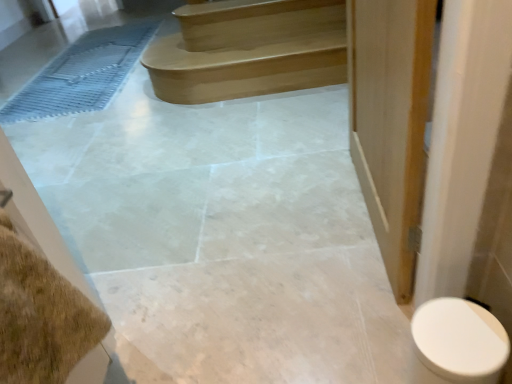
The height and width of the screenshot is (384, 512). Describe the element at coordinates (249, 50) in the screenshot. I see `satin wood stairs at upper center` at that location.

This screenshot has width=512, height=384. Identify the location of white glossy toilet at lower right. (457, 343).

You are a GUI agent. You are given a task and a screenshot of the screen. Output one action in this format:
    pyautogui.click(x=<x>, y=<y>)
    Task: Click on the blue rubber bath mat at left
    The image size is (512, 384).
    Given the screenshot: What is the action you would take?
    pyautogui.click(x=82, y=74)

Could you tell me if blue rubber bath mat at left is facing white glossy toilet at lower right?

No, blue rubber bath mat at left is not facing towards white glossy toilet at lower right.

Is blue rubber bath mat at left next to white glossy toilet at lower right?

No, blue rubber bath mat at left is not touching white glossy toilet at lower right.

Who is shorter, blue rubber bath mat at left or white glossy toilet at lower right?

blue rubber bath mat at left is shorter.

Is white glossy toilet at lower right with satin wood stairs at upper center?

No, white glossy toilet at lower right is not with satin wood stairs at upper center.

Does white glossy toilet at lower right have a lesser width compared to satin wood stairs at upper center?

Correct, the width of white glossy toilet at lower right is less than that of satin wood stairs at upper center.

Is the position of white glossy toilet at lower right less distant than that of satin wood stairs at upper center?

That is True.

Which of these two, white glossy toilet at lower right or blue rubber bath mat at left, stands taller?

white glossy toilet at lower right.

In the image, is white glossy toilet at lower right on the left side or the right side of blue rubber bath mat at left?

white glossy toilet at lower right is positioned on blue rubber bath mat at left's right side.

Between white glossy toilet at lower right and blue rubber bath mat at left, which one is positioned behind?

blue rubber bath mat at left is more distant.

Considering the sizes of objects white glossy toilet at lower right and blue rubber bath mat at left in the image provided, who is thinner, white glossy toilet at lower right or blue rubber bath mat at left?

Thinner between the two is white glossy toilet at lower right.

In terms of size, does blue rubber bath mat at left appear bigger or smaller than satin wood stairs at upper center?

Clearly, blue rubber bath mat at left is smaller in size than satin wood stairs at upper center.

Would you say blue rubber bath mat at left is outside satin wood stairs at upper center?

blue rubber bath mat at left is positioned outside satin wood stairs at upper center.

You are a GUI agent. You are given a task and a screenshot of the screen. Output one action in this format:
    pyautogui.click(x=<x>, y=<y>)
    Task: Click on the stairs on the right of blue rubber bath mat at left
    
    Given the screenshot: What is the action you would take?
    pyautogui.click(x=249, y=50)

Is blue rubber bath mat at left turned away from satin wood stairs at upper center?

No.

Is satin wood stairs at upper center not close to blue rubber bath mat at left?

Yes, satin wood stairs at upper center and blue rubber bath mat at left are quite far apart.

From the picture: From the image's perspective, who appears lower, satin wood stairs at upper center or blue rubber bath mat at left?

satin wood stairs at upper center is shown below in the image.

Does point (191, 50) lie in front of point (145, 27)?

That is True.

Is satin wood stairs at upper center inside or outside of white glossy toilet at lower right?

satin wood stairs at upper center is not enclosed by white glossy toilet at lower right.

Image resolution: width=512 pixels, height=384 pixels. In order to click on toilet that is in front of the satin wood stairs at upper center in this screenshot , I will do `click(457, 343)`.

Does satin wood stairs at upper center turn towards white glossy toilet at lower right?

→ Yes, satin wood stairs at upper center is turned towards white glossy toilet at lower right.

Is satin wood stairs at upper center at the right side of white glossy toilet at lower right?

No.

Find the location of a particular element. Image resolution: width=512 pixels, height=384 pixels. bath mat lying behind the white glossy toilet at lower right is located at coordinates (82, 74).

Locate an element on the screen. toilet below the satin wood stairs at upper center (from a real-world perspective) is located at coordinates tap(457, 343).

Considering their positions, is blue rubber bath mat at left positioned closer to satin wood stairs at upper center than white glossy toilet at lower right?

blue rubber bath mat at left lies closer to satin wood stairs at upper center than the other object.

Which object lies nearer to the anchor point satin wood stairs at upper center, white glossy toilet at lower right or blue rubber bath mat at left?

blue rubber bath mat at left lies closer to satin wood stairs at upper center than the other object.

Considering their positions, is white glossy toilet at lower right positioned closer to blue rubber bath mat at left than satin wood stairs at upper center?

satin wood stairs at upper center.

When comparing their distances from blue rubber bath mat at left, does satin wood stairs at upper center or white glossy toilet at lower right seem closer?

satin wood stairs at upper center lies closer to blue rubber bath mat at left than the other object.

Considering their positions, is satin wood stairs at upper center positioned closer to white glossy toilet at lower right than blue rubber bath mat at left?

The object closer to white glossy toilet at lower right is satin wood stairs at upper center.

Looking at this image, based on their spatial positions, is blue rubber bath mat at left or satin wood stairs at upper center closer to white glossy toilet at lower right?

Among the two, satin wood stairs at upper center is located nearer to white glossy toilet at lower right.

Identify the location of stairs between white glossy toilet at lower right and blue rubber bath mat at left from front to back. Image resolution: width=512 pixels, height=384 pixels. (249, 50).